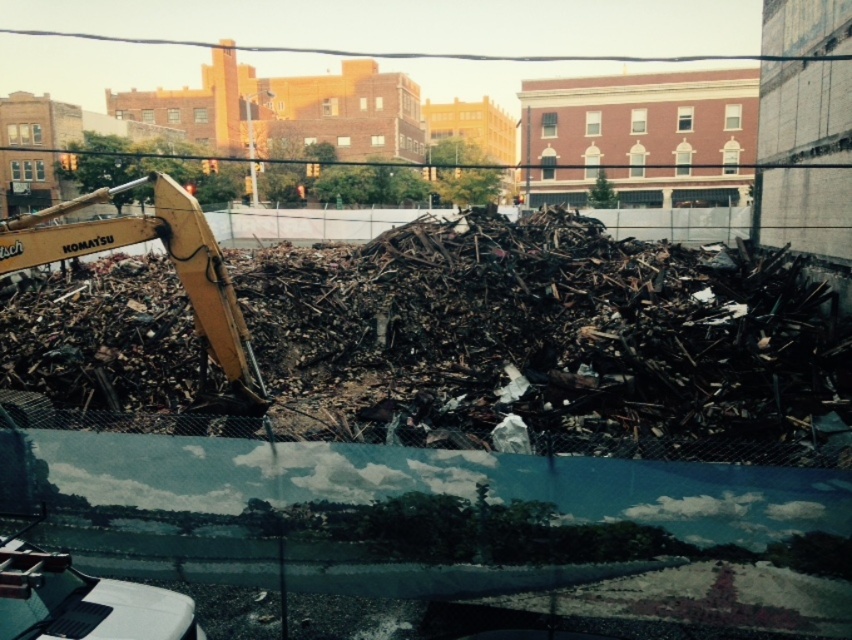
Question: Where is dark metallic debris at center located in relation to yellow metallic excavator at left in the image?

Choices:
 (A) below
 (B) above

Answer: (A)

Question: Which object is closer to the camera taking this photo?

Choices:
 (A) dark metallic debris at center
 (B) yellow metallic excavator at left

Answer: (A)

Question: Among these points, which one is nearest to the camera?

Choices:
 (A) (32, 266)
 (B) (304, 284)

Answer: (A)

Question: Observing the image, what is the correct spatial positioning of dark metallic debris at center in reference to yellow metallic excavator at left?

Choices:
 (A) left
 (B) right

Answer: (B)

Question: Is dark metallic debris at center above yellow metallic excavator at left?

Choices:
 (A) no
 (B) yes

Answer: (A)

Question: Which object is farther from the camera taking this photo?

Choices:
 (A) dark metallic debris at center
 (B) yellow metallic excavator at left

Answer: (B)